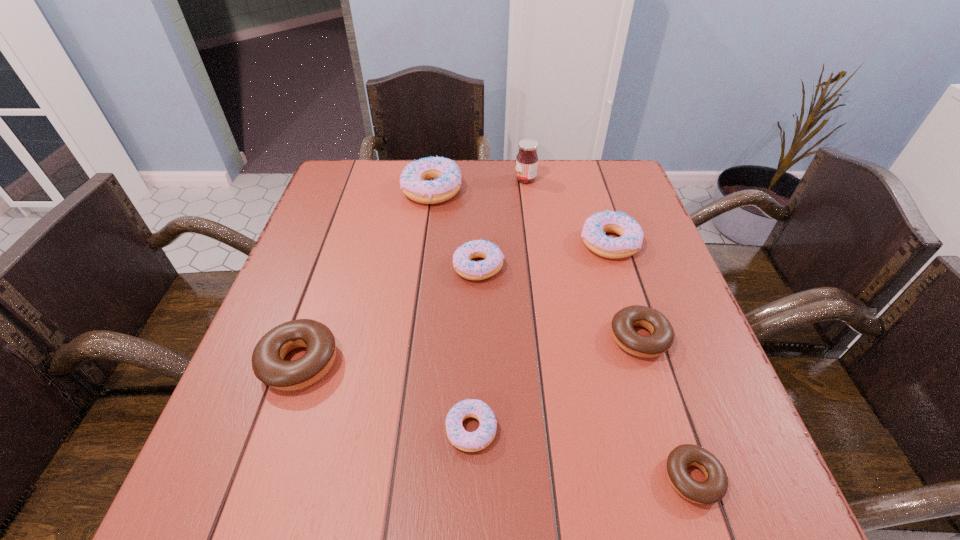
Find the location of a particular element. brown doughnut that stands as the second closest to the nearest purple doughnut is located at coordinates (661, 338).

At what (x,y) coordinates should I click in order to perform the action: click on brown doughnut that stands as the closest to the biggest purple doughnut. Please return your answer as a coordinate pair (x, y). The height and width of the screenshot is (540, 960). Looking at the image, I should click on [x=268, y=364].

In order to click on free point that satisfies the following two spatial constraints: 1. on the front side of the biggest brown doughnut; 2. on the right side of the smallest purple doughnut in this screenshot , I will do (276, 429).

Where is `free space that satisfies the following two spatial constraints: 1. on the back side of the rightmost purple doughnut; 2. on the label side of the tallest object`? This screenshot has height=540, width=960. free space that satisfies the following two spatial constraints: 1. on the back side of the rightmost purple doughnut; 2. on the label side of the tallest object is located at coordinates (589, 179).

The width and height of the screenshot is (960, 540). I want to click on free space that satisfies the following two spatial constraints: 1. on the front side of the smallest brown doughnut; 2. on the right side of the rightmost purple doughnut, so click(x=684, y=478).